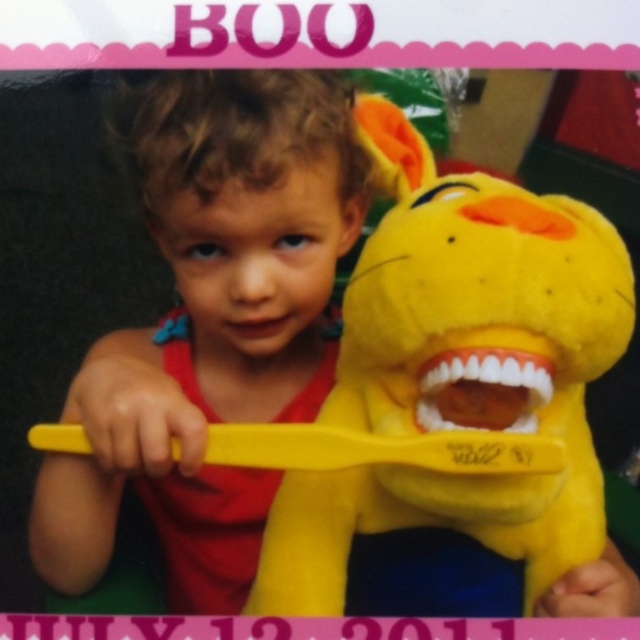
You are a dentist teaching a child how to brush their teeth. You have a matte yellow toothbrush at center and a yellow plush toy at center. Which object is bigger?

The matte yellow toothbrush at center is larger than the yellow plush toy at center.

You are a dentist who needs to ensure proper brushing distance for a child. The recommended distance between the toothbrush and the toy teeth should be no more than 5 inches to prevent discomfort. Based on the scene, is the current distance between the matte yellow toothbrush at center and the yellow plush toy at center within the recommended range?

The distance between the matte yellow toothbrush at center and the yellow plush toy at center is 5.21 inches, which exceeds the recommended 5 inches. Therefore, the current distance is not within the recommended range and may cause discomfort.

You are a parent trying to choose a toothbrush for your child. You have two options in front of you, the matte yellow toothbrush at center and the yellow plastic toothbrush at center. Which one is larger?

The matte yellow toothbrush at center is bigger than the yellow plastic toothbrush at center, so the matte yellow toothbrush at center is the larger one.